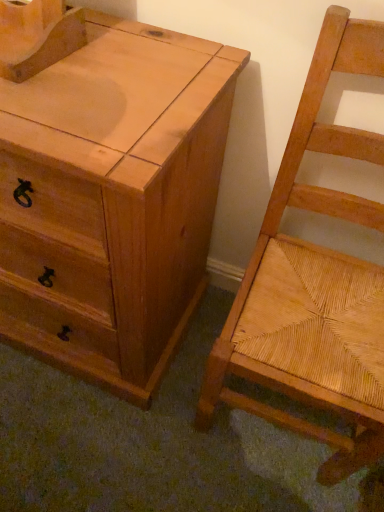
Question: Is natural wood woven seat at right located outside natural wood chest of drawers at left?

Choices:
 (A) yes
 (B) no

Answer: (A)

Question: From the image's perspective, is natural wood woven seat at right on top of natural wood chest of drawers at left?

Choices:
 (A) yes
 (B) no

Answer: (B)

Question: Can you confirm if natural wood woven seat at right is taller than natural wood chest of drawers at left?

Choices:
 (A) no
 (B) yes

Answer: (B)

Question: Is natural wood woven seat at right at the left side of natural wood chest of drawers at left?

Choices:
 (A) yes
 (B) no

Answer: (B)

Question: Is natural wood woven seat at right oriented away from natural wood chest of drawers at left?

Choices:
 (A) no
 (B) yes

Answer: (A)

Question: From the image's perspective, is natural wood woven seat at right beneath natural wood chest of drawers at left?

Choices:
 (A) yes
 (B) no

Answer: (A)

Question: From a real-world perspective, is natural wood chest of drawers at left below natural wood woven seat at right?

Choices:
 (A) yes
 (B) no

Answer: (A)

Question: From the image's perspective, is natural wood chest of drawers at left on natural wood woven seat at right?

Choices:
 (A) yes
 (B) no

Answer: (A)

Question: Can you confirm if natural wood chest of drawers at left is smaller than natural wood woven seat at right?

Choices:
 (A) no
 (B) yes

Answer: (A)

Question: From the image's perspective, is natural wood chest of drawers at left below natural wood woven seat at right?

Choices:
 (A) no
 (B) yes

Answer: (A)

Question: Is natural wood woven seat at right located within natural wood chest of drawers at left?

Choices:
 (A) yes
 (B) no

Answer: (B)

Question: Is the surface of natural wood chest of drawers at left in direct contact with natural wood woven seat at right?

Choices:
 (A) no
 (B) yes

Answer: (A)

Question: Relative to natural wood woven seat at right, is natural wood chest of drawers at left in front or behind?

Choices:
 (A) front
 (B) behind

Answer: (B)